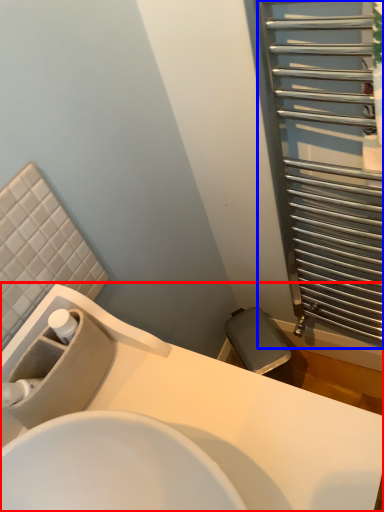
Question: Which object is closer to the camera taking this photo, sink (highlighted by a red box) or screen door (highlighted by a blue box)?

Choices:
 (A) sink
 (B) screen door

Answer: (A)